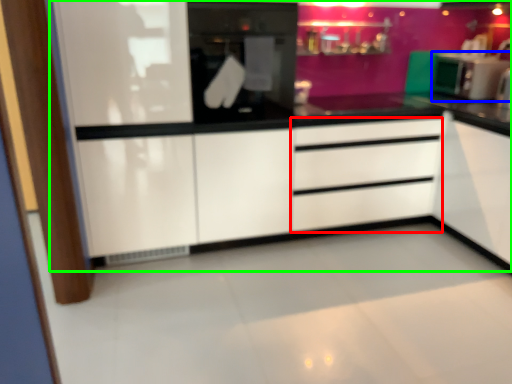
Question: Considering the real-world distances, which object is farthest from drawer (highlighted by a red box)? kitchen appliance (highlighted by a blue box) or dresser (highlighted by a green box)?

Choices:
 (A) kitchen appliance
 (B) dresser

Answer: (A)